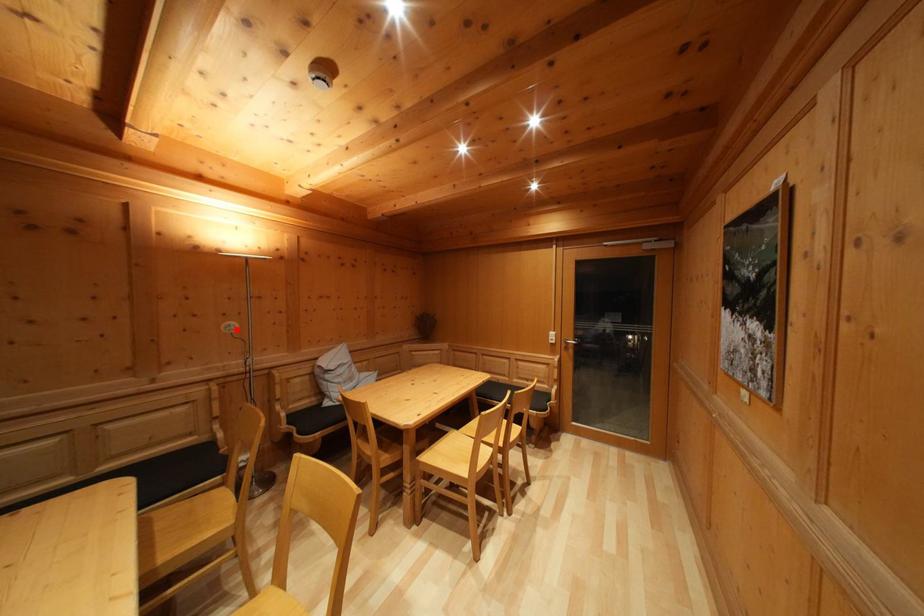
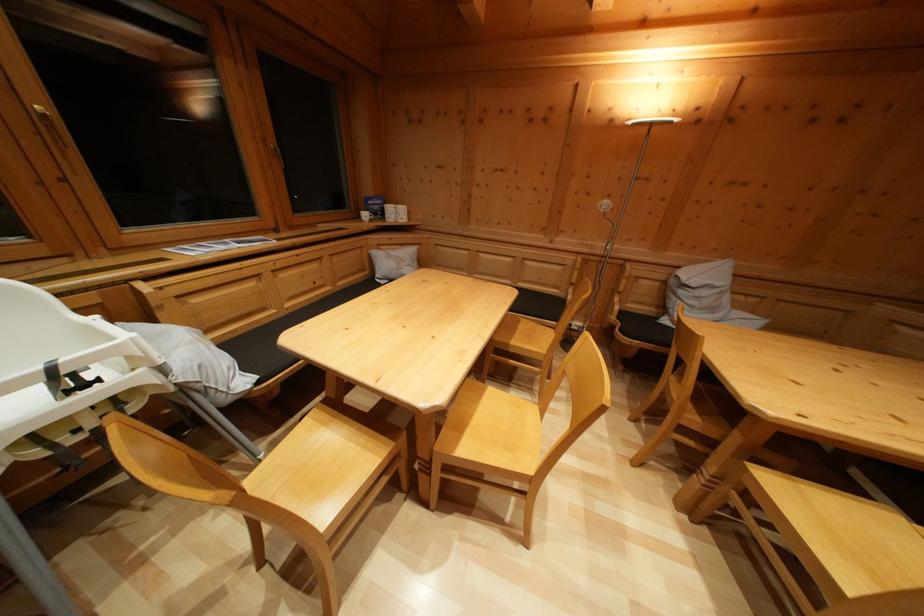
Find the pixel in the second image that matches the highlighted location in the first image.

(613, 208)